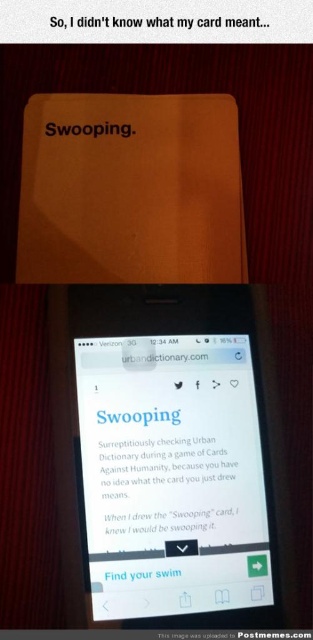
Question: Does white paper at center appear under white matte text at center?

Choices:
 (A) no
 (B) yes

Answer: (A)

Question: Does white paper at center have a lesser width compared to white matte text at center?

Choices:
 (A) no
 (B) yes

Answer: (A)

Question: Which is farther from the white paper at center?

Choices:
 (A) white matte text at center
 (B) white glossy screen at center

Answer: (A)

Question: Based on their relative distances, which object is nearer to the white matte text at center?

Choices:
 (A) white paper at upper center
 (B) white glossy screen at center

Answer: (B)

Question: Does white paper at center have a smaller size compared to white matte text at center?

Choices:
 (A) yes
 (B) no

Answer: (B)

Question: Among these objects, which one is farthest from the camera?

Choices:
 (A) white paper at center
 (B) white glossy screen at center
 (C) white matte text at center

Answer: (A)